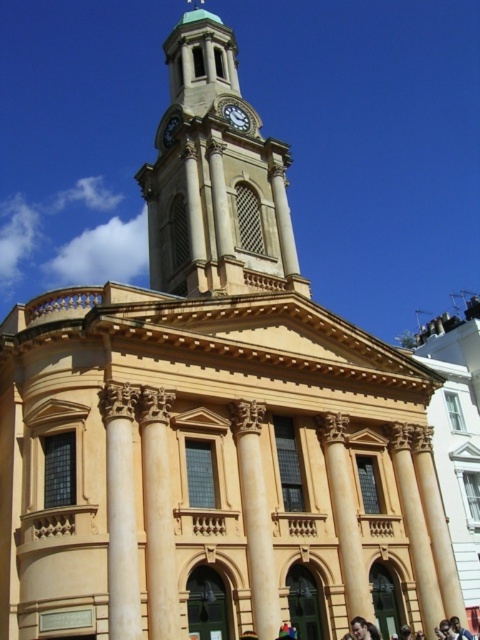
You are an architect planning to add a new decorative element to the building. You have a choice between placing it either to the left of the smooth beige clock tower at upper center or to the right of the gold metallic clock at upper center. Based on their widths, which side would you choose to ensure the element fits better?

The smooth beige clock tower at upper center might be wider than the gold metallic clock at upper center, so placing the decorative element to the left of the smooth beige clock tower at upper center would provide more space for it to fit better.

You are an architect designing a miniature model of this building. You need to ensure the beige stone column at center and the gold metallic clock at upper center are scaled correctly. Which object should be made taller in the model?

The beige stone column at center should be made taller in the model because it is taller than the gold metallic clock at upper center in the original image.